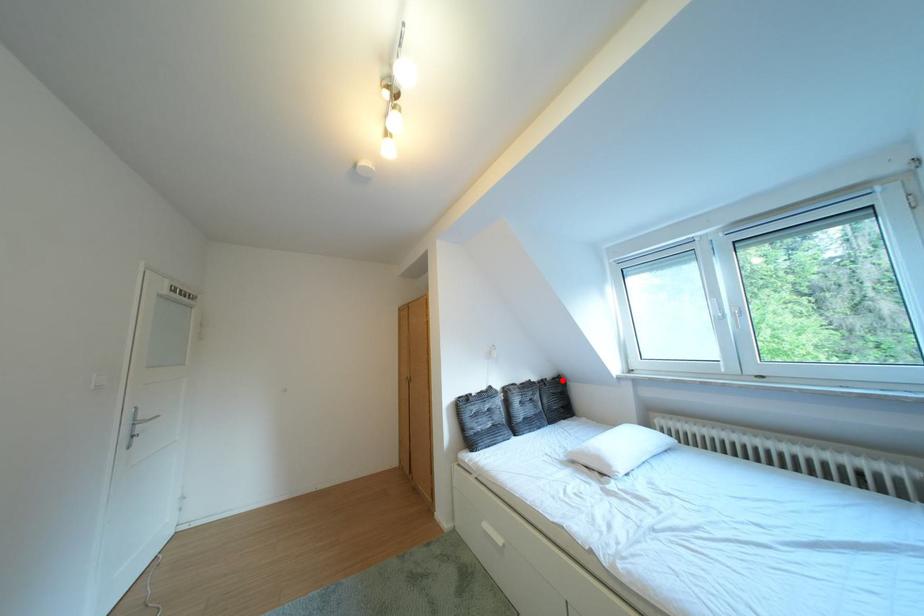
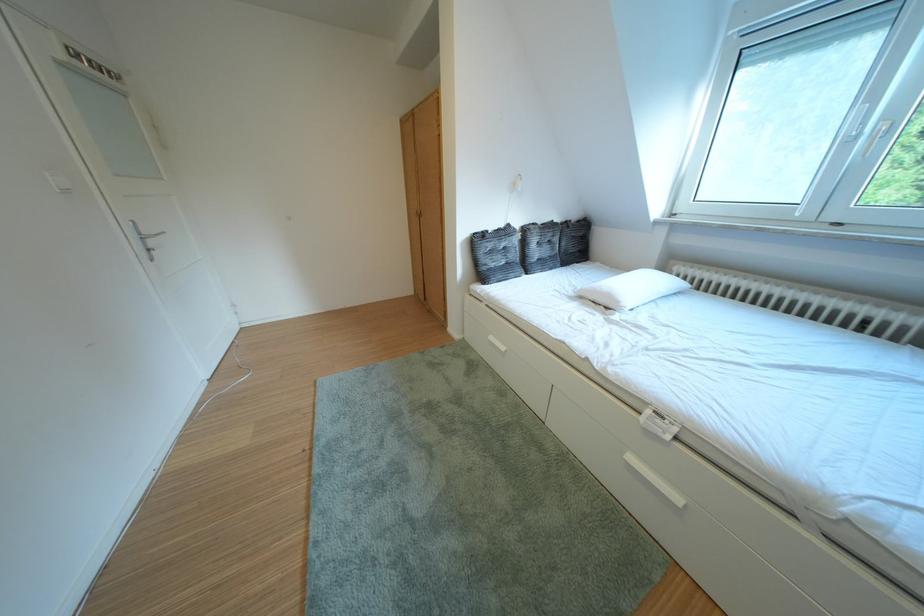
Locate, in the second image, the point that corresponds to the highlighted location in the first image.

(588, 222)